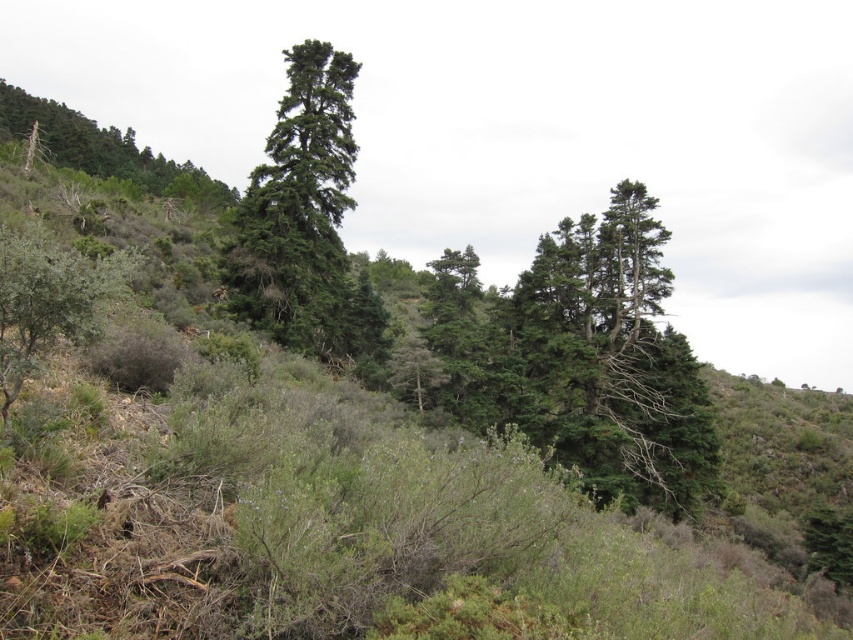
Between green needle-like tree at center and green leafy bush at lower left, which one has more height?

green needle-like tree at center is taller.

Is green needle-like tree at center above green leafy bush at lower left?

Yes.

Between point (305, 45) and point (74, 324), which one is positioned in front?

Point (74, 324)

At what (x,y) coordinates should I click in order to perform the action: click on green needle-like tree at center. Please return your answer as a coordinate pair (x, y). Looking at the image, I should click on (299, 208).

Can you confirm if green needle-like tree at center is shorter than green leafy tree at upper left?

Correct, green needle-like tree at center is not as tall as green leafy tree at upper left.

Is point (289, 92) more distant than point (44, 97)?

That is False.

I want to click on green needle-like tree at center, so click(299, 208).

Does green leafy bush at lower left have a greater width compared to green leafy tree at upper left?

Incorrect, green leafy bush at lower left's width does not surpass green leafy tree at upper left's.

Locate an element on the screen. This screenshot has width=853, height=640. green leafy bush at lower left is located at coordinates (49, 300).

Where is `green leafy bush at lower left`? Image resolution: width=853 pixels, height=640 pixels. green leafy bush at lower left is located at coordinates (49, 300).